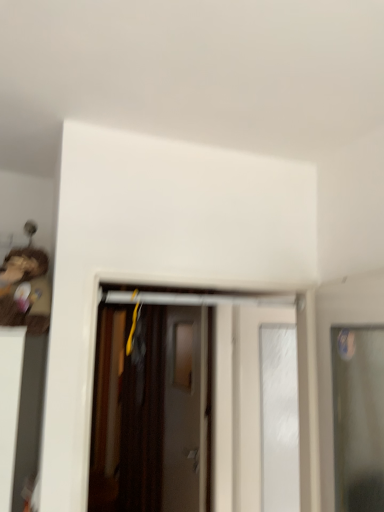
What is the approximate height of wooden door at center, the first door in the back-to-front sequence?

It is 1.45 meters.

The image size is (384, 512). What do you see at coordinates (177, 391) in the screenshot?
I see `matte brown door at center, which is counted as the third door, starting from the back` at bounding box center [177, 391].

What are the coordinates of `white glossy door at center, the second door positioned from the back` in the screenshot? It's located at (249, 400).

Which of these two, white glossy door at center, which is counted as the 3th door, starting from the front, or transparent glass door at right, placed as the fourth door when sorted from back to front, is wider?

Wider between the two is transparent glass door at right, placed as the fourth door when sorted from back to front.

Does white glossy door at center, which is counted as the 3th door, starting from the front, have a smaller size compared to transparent glass door at right, the 1th door from the front?

Yes, white glossy door at center, which is counted as the 3th door, starting from the front, is smaller than transparent glass door at right, the 1th door from the front.

In the image, is white glossy door at center, the second door positioned from the back, on the left side or the right side of transparent glass door at right, placed as the fourth door when sorted from back to front?

white glossy door at center, the second door positioned from the back, is to the left of transparent glass door at right, placed as the fourth door when sorted from back to front.

In the scene shown: Is white glossy door at center, which is counted as the 3th door, starting from the front, next to transparent glass door at right, the 1th door from the front?

No, white glossy door at center, which is counted as the 3th door, starting from the front, is not beside transparent glass door at right, the 1th door from the front.

Which is correct: transparent glass door at right, the 1th door from the front, is inside wooden toy at left, or outside of it?

transparent glass door at right, the 1th door from the front, is outside wooden toy at left.

From the picture: Is transparent glass door at right, placed as the fourth door when sorted from back to front, to the left or to the right of wooden toy at left in the image?

In the image, transparent glass door at right, placed as the fourth door when sorted from back to front, appears on the right side of wooden toy at left.

From the image's perspective, is transparent glass door at right, placed as the fourth door when sorted from back to front, located beneath wooden toy at left?

Correct, transparent glass door at right, placed as the fourth door when sorted from back to front, appears lower than wooden toy at left in the image.

Does transparent glass door at right, placed as the fourth door when sorted from back to front, have a larger size compared to wooden toy at left?

Indeed, transparent glass door at right, placed as the fourth door when sorted from back to front, has a larger size compared to wooden toy at left.

Which of these two, matte brown door at center, positioned as the second door in front-to-back order, or transparent glass door at right, the 1th door from the front, stands shorter?

With less height is transparent glass door at right, the 1th door from the front.

Is matte brown door at center, positioned as the second door in front-to-back order, facing towards transparent glass door at right, the 1th door from the front?

Yes, matte brown door at center, positioned as the second door in front-to-back order, is facing transparent glass door at right, the 1th door from the front.

Is matte brown door at center, which is counted as the third door, starting from the back, not close to transparent glass door at right, placed as the fourth door when sorted from back to front?

Yes.

From a real-world perspective, is matte brown door at center, positioned as the second door in front-to-back order, physically located above or below wooden door at center, the first door in the back-to-front sequence?

From a real-world perspective, matte brown door at center, positioned as the second door in front-to-back order, is physically above wooden door at center, the first door in the back-to-front sequence.

The width and height of the screenshot is (384, 512). What are the coordinates of `door on the left of matte brown door at center, positioned as the second door in front-to-back order` in the screenshot? It's located at (185, 410).

Is matte brown door at center, which is counted as the third door, starting from the back, facing away from wooden door at center, which appears as the 4th door when viewed from the front?

Yes, matte brown door at center, which is counted as the third door, starting from the back,'s orientation is away from wooden door at center, which appears as the 4th door when viewed from the front.

Considering the relative positions of matte brown door at center, which is counted as the third door, starting from the back, and wooden door at center, which appears as the 4th door when viewed from the front, in the image provided, is matte brown door at center, which is counted as the third door, starting from the back, behind wooden door at center, which appears as the 4th door when viewed from the front,?

No.

Which object is further away from the camera taking this photo, wooden toy at left or wooden door at center, which appears as the 4th door when viewed from the front?

wooden door at center, which appears as the 4th door when viewed from the front, is behind.

Find the location of a particular element. couple above the wooden door at center, which appears as the 4th door when viewed from the front (from the image's perspective) is located at coordinates (23, 293).

Considering the sizes of objects wooden toy at left and wooden door at center, which appears as the 4th door when viewed from the front, in the image provided, who is bigger, wooden toy at left or wooden door at center, which appears as the 4th door when viewed from the front,?

wooden door at center, which appears as the 4th door when viewed from the front, is bigger.

In the scene shown: From a real-world perspective, who is located higher, transparent glass door at right, placed as the fourth door when sorted from back to front, or wooden door at center, which appears as the 4th door when viewed from the front?

transparent glass door at right, placed as the fourth door when sorted from back to front.

Which object is closer to the camera taking this photo, transparent glass door at right, placed as the fourth door when sorted from back to front, or wooden door at center, which appears as the 4th door when viewed from the front?

transparent glass door at right, placed as the fourth door when sorted from back to front.

Consider the image. Is wooden door at center, which appears as the 4th door when viewed from the front, located within transparent glass door at right, placed as the fourth door when sorted from back to front?

Definitely not — wooden door at center, which appears as the 4th door when viewed from the front, is not inside transparent glass door at right, placed as the fourth door when sorted from back to front.

Considering the positions of point (360, 505) and point (174, 390), is point (360, 505) closer or farther from the camera than point (174, 390)?

Point (360, 505) appears to be closer to the viewer than point (174, 390).

Would you say transparent glass door at right, placed as the fourth door when sorted from back to front, is inside or outside white glossy door at center, the second door positioned from the back?

The correct answer is: outside.

Looking at this image, from a real-world perspective, relative to white glossy door at center, the second door positioned from the back, is transparent glass door at right, the 1th door from the front, vertically above or below?

From a real-world perspective, transparent glass door at right, the 1th door from the front, is physically above white glossy door at center, the second door positioned from the back.

How many degrees apart are the facing directions of transparent glass door at right, placed as the fourth door when sorted from back to front, and white glossy door at center, the second door positioned from the back?

The angle between the facing direction of transparent glass door at right, placed as the fourth door when sorted from back to front, and the facing direction of white glossy door at center, the second door positioned from the back, is 88.1 degrees.

The image size is (384, 512). There is a white glossy door at center, which is counted as the 3th door, starting from the front. Identify the location of the 1st door above it (from a real-world perspective). (358, 418).

This screenshot has width=384, height=512. Find the location of `couple lying behind the transparent glass door at right, placed as the fourth door when sorted from back to front`. couple lying behind the transparent glass door at right, placed as the fourth door when sorted from back to front is located at coordinates (23, 293).

Estimate the real-world distances between objects in this image. Which object is further from wooden door at center, which appears as the 4th door when viewed from the front, white glossy door at center, which is counted as the 3th door, starting from the front, or matte brown door at center, which is counted as the third door, starting from the back?

Among the two, white glossy door at center, which is counted as the 3th door, starting from the front, is located further to wooden door at center, which appears as the 4th door when viewed from the front.

Based on their spatial positions, is wooden door at center, which appears as the 4th door when viewed from the front, or white glossy door at center, which is counted as the 3th door, starting from the front, further from matte brown door at center, which is counted as the third door, starting from the back?

Among the two, white glossy door at center, which is counted as the 3th door, starting from the front, is located further to matte brown door at center, which is counted as the third door, starting from the back.

In the scene shown: Looking at the image, which one is located closer to matte brown door at center, positioned as the second door in front-to-back order, white glossy door at center, which is counted as the 3th door, starting from the front, or wooden toy at left?

A: white glossy door at center, which is counted as the 3th door, starting from the front, is positioned closer to the anchor matte brown door at center, positioned as the second door in front-to-back order.

Looking at the image, which one is located further to wooden door at center, which appears as the 4th door when viewed from the front, matte brown door at center, positioned as the second door in front-to-back order, or transparent glass door at right, the 1th door from the front?

transparent glass door at right, the 1th door from the front, is further to wooden door at center, which appears as the 4th door when viewed from the front.

Considering their positions, is wooden toy at left positioned closer to white glossy door at center, the second door positioned from the back, than wooden door at center, which appears as the 4th door when viewed from the front?

Among the two, wooden door at center, which appears as the 4th door when viewed from the front, is located nearer to white glossy door at center, the second door positioned from the back.

Considering their positions, is transparent glass door at right, placed as the fourth door when sorted from back to front, positioned further to matte brown door at center, which is counted as the third door, starting from the back, than wooden toy at left?

wooden toy at left is positioned further to the anchor matte brown door at center, which is counted as the third door, starting from the back.

Looking at the image, which one is located closer to matte brown door at center, positioned as the second door in front-to-back order, transparent glass door at right, placed as the fourth door when sorted from back to front, or wooden door at center, the first door in the back-to-front sequence?

wooden door at center, the first door in the back-to-front sequence, is positioned closer to the anchor matte brown door at center, positioned as the second door in front-to-back order.

Looking at the image, which one is located further to wooden toy at left, wooden door at center, the first door in the back-to-front sequence, or transparent glass door at right, the 1th door from the front?

The object further to wooden toy at left is wooden door at center, the first door in the back-to-front sequence.

Find the location of `door between transparent glass door at right, the 1th door from the front, and white glossy door at center, the second door positioned from the back, in the front-back direction`. door between transparent glass door at right, the 1th door from the front, and white glossy door at center, the second door positioned from the back, in the front-back direction is located at coordinates (177, 391).

You are a GUI agent. You are given a task and a screenshot of the screen. Output one action in this format:
    pyautogui.click(x=<x>, y=<y>)
    Task: Click on the door positioned between wooden toy at left and wooden door at center, the first door in the back-to-front sequence, from near to far
    
    Given the screenshot: What is the action you would take?
    (x=249, y=400)

Locate an element on the screen. This screenshot has height=512, width=384. couple between transparent glass door at right, the 1th door from the front, and wooden door at center, the first door in the back-to-front sequence, from front to back is located at coordinates (23, 293).

Find the location of a particular element. couple between transparent glass door at right, the 1th door from the front, and white glossy door at center, which is counted as the 3th door, starting from the front, in the front-back direction is located at coordinates (23, 293).